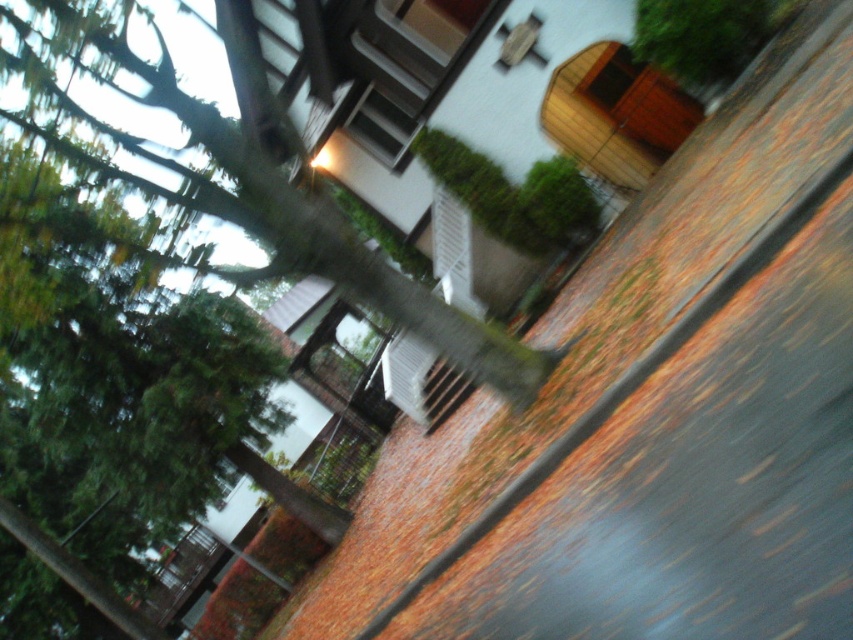
Question: Which of the following is the closest to the observer?

Choices:
 (A) (480, 336)
 (B) (720, 33)

Answer: (A)

Question: Does green leafy tree at upper left have a lesser width compared to green leafy tree at upper right?

Choices:
 (A) yes
 (B) no

Answer: (B)

Question: Which point is farther to the camera?

Choices:
 (A) (415, 314)
 (B) (709, 19)

Answer: (B)

Question: Does green leafy tree at upper left have a lesser width compared to green leafy tree at upper right?

Choices:
 (A) no
 (B) yes

Answer: (A)

Question: Can you confirm if green leafy tree at upper left is positioned to the right of green leafy tree at upper right?

Choices:
 (A) yes
 (B) no

Answer: (B)